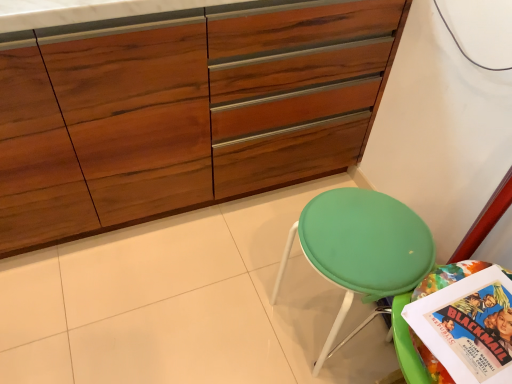
This screenshot has height=384, width=512. I want to click on empty space that is ontop of multicolored paper comic book at lower right (from a real-world perspective), so click(473, 328).